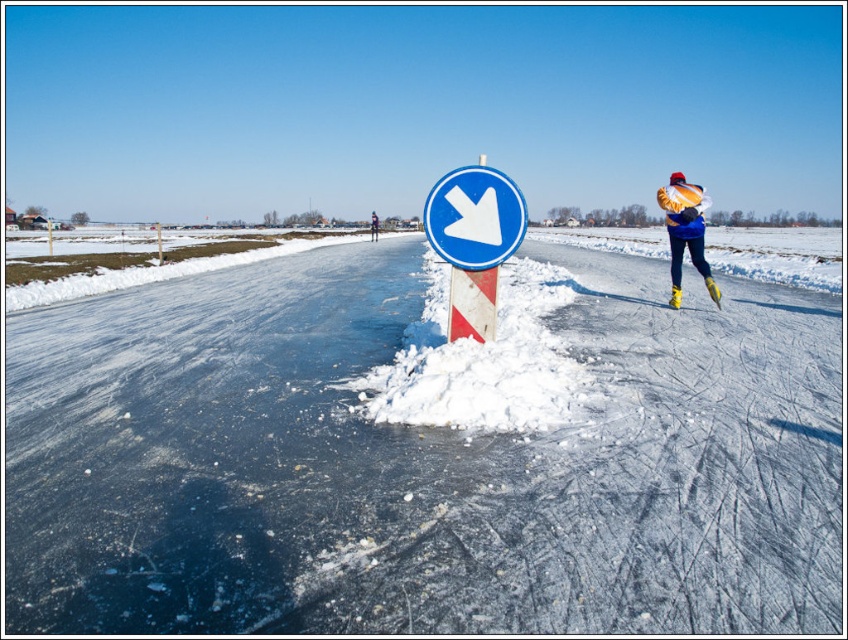
Question: Is white plastic arrow at center wider than yellow matte ski at right?

Choices:
 (A) no
 (B) yes

Answer: (B)

Question: Does yellow synthetic skates at right lie behind blue woolen hat at upper center?

Choices:
 (A) yes
 (B) no

Answer: (B)

Question: Estimate the real-world distances between objects in this image. Which object is farther from the white powdery snow at center?

Choices:
 (A) blue woolen hat at upper center
 (B) white plastic arrow at center
 (C) yellow synthetic skates at right

Answer: (A)

Question: Which point is closer to the camera taking this photo?

Choices:
 (A) (678, 577)
 (B) (685, 211)

Answer: (A)

Question: Does yellow matte ski at right appear over blue woolen hat at upper center?

Choices:
 (A) yes
 (B) no

Answer: (B)

Question: Considering the real-world distances, which object is closest to the blue woolen hat at upper center?

Choices:
 (A) yellow synthetic skates at right
 (B) white plastic arrow at center
 (C) blue plastic sign at center
 (D) yellow matte ski at right

Answer: (A)